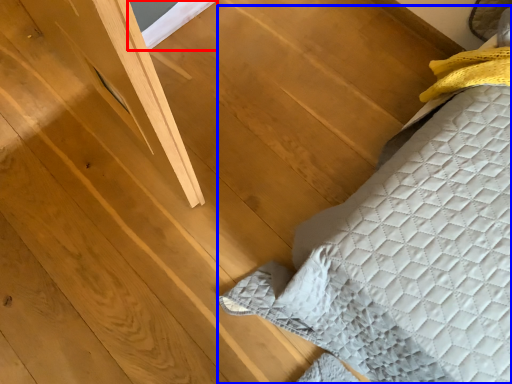
Question: Among these objects, which one is nearest to the camera, window (highlighted by a red box) or furniture (highlighted by a blue box)?

Choices:
 (A) window
 (B) furniture

Answer: (B)